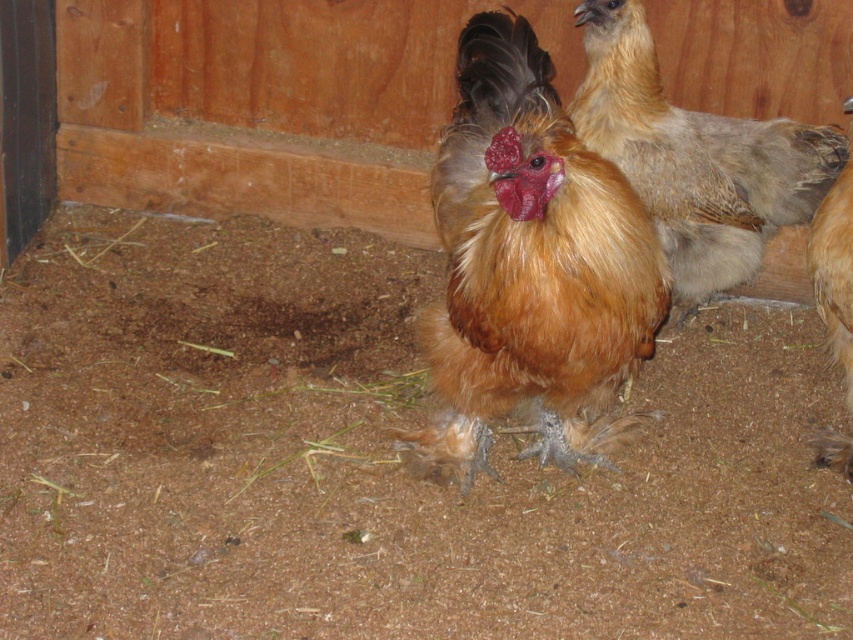
Question: Which point is farther to the camera?

Choices:
 (A) golden feathered chicken at center
 (B) golden brown feathered rooster at center
 (C) brown fluffy chicken at right

Answer: (A)

Question: Which object appears closest to the camera in this image?

Choices:
 (A) brown fluffy chicken at right
 (B) golden feathered chicken at center

Answer: (A)

Question: Is golden feathered chicken at center further to camera compared to brown fluffy chicken at right?

Choices:
 (A) yes
 (B) no

Answer: (A)

Question: Can you confirm if golden brown feathered rooster at center is positioned to the left of golden feathered chicken at center?

Choices:
 (A) no
 (B) yes

Answer: (B)

Question: Among these objects, which one is farthest from the camera?

Choices:
 (A) brown fluffy chicken at right
 (B) golden brown feathered rooster at center

Answer: (A)

Question: From the image, what is the correct spatial relationship of golden brown feathered rooster at center in relation to golden feathered chicken at center?

Choices:
 (A) below
 (B) above

Answer: (A)